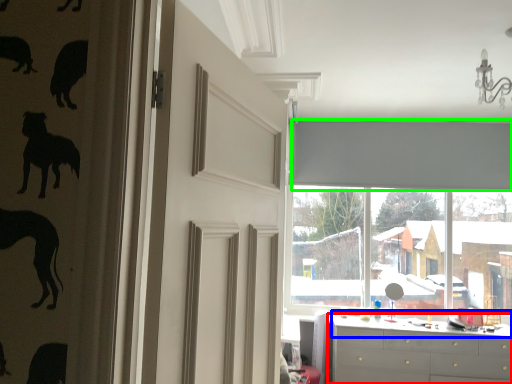
Question: Which object is the farthest from chest of drawers (highlighted by a red box)? Choose among these: counter top (highlighted by a blue box) or curtain (highlighted by a green box).

Choices:
 (A) counter top
 (B) curtain

Answer: (B)